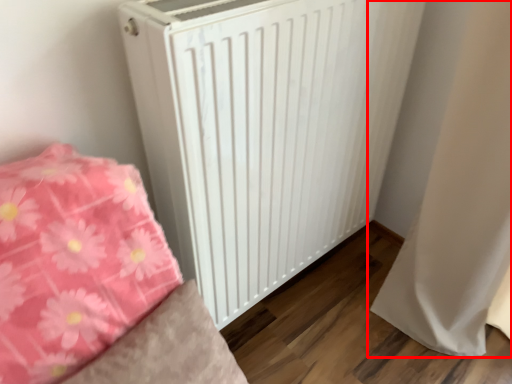
Question: Where is curtain (annotated by the red box) located in relation to radiator in the image?

Choices:
 (A) left
 (B) right

Answer: (B)